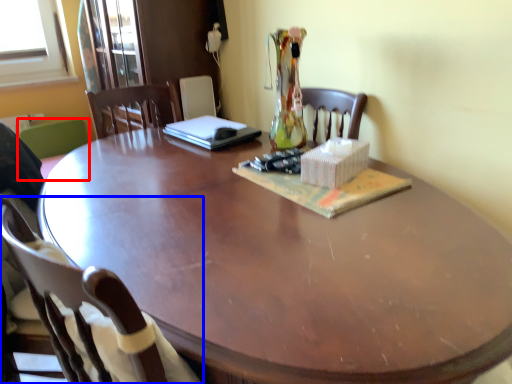
Question: Which of the following is the closest to the observer, chair (highlighted by a red box) or chair (highlighted by a blue box)?

Choices:
 (A) chair
 (B) chair

Answer: (B)